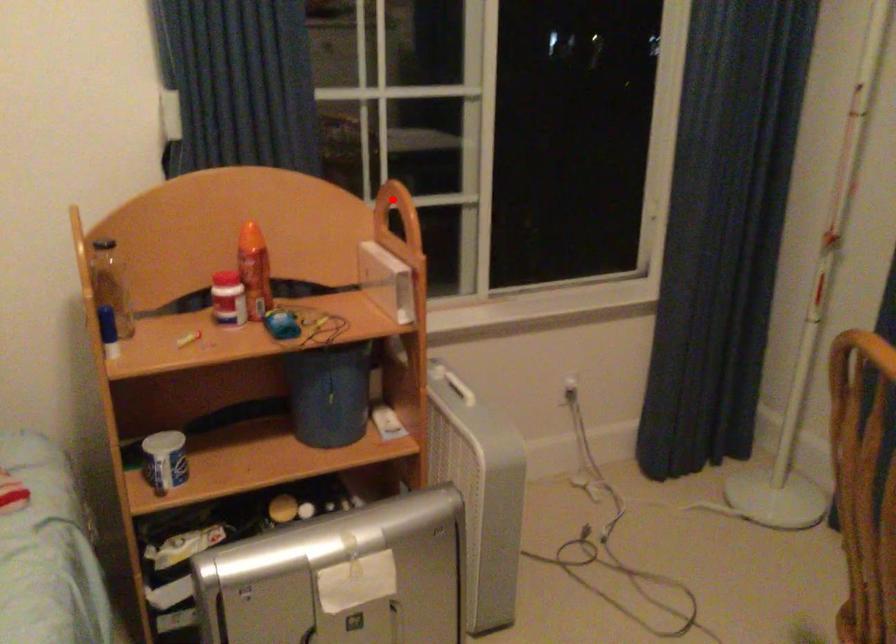
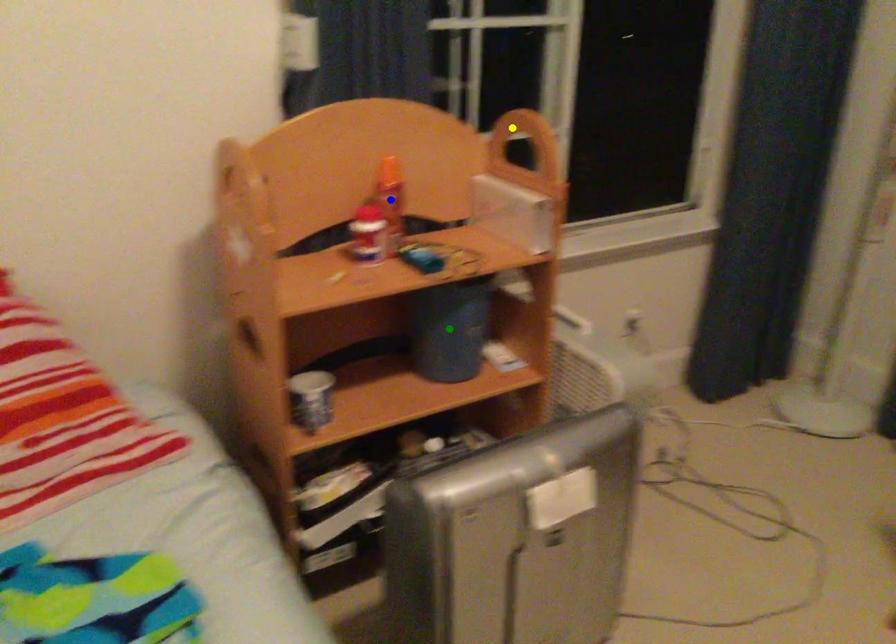
Question: I am providing you with two images of the same scene from different viewpoints. A red point is marked on the first image. You are given multiple points on the second image. Can you choose the point in image 2 that corresponds to the point in image 1?

Choices:
 (A) green point
 (B) yellow point
 (C) blue point

Answer: (B)